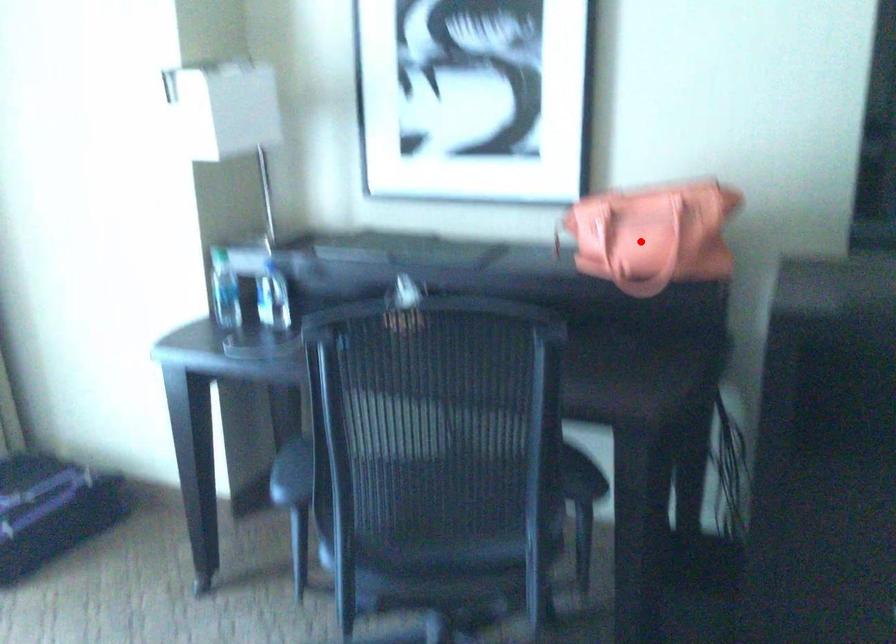
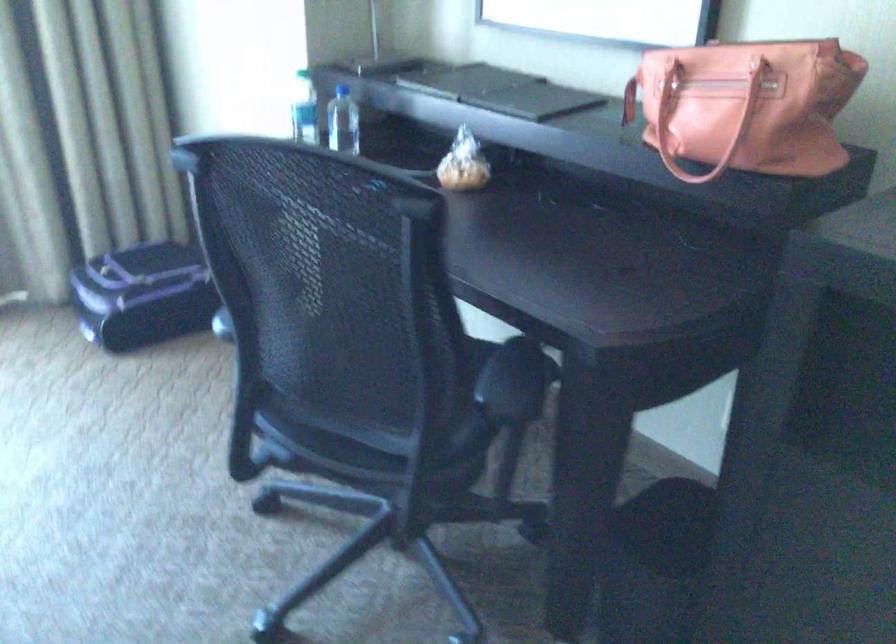
Find the pixel in the second image that matches the highlighted location in the first image.

(704, 122)